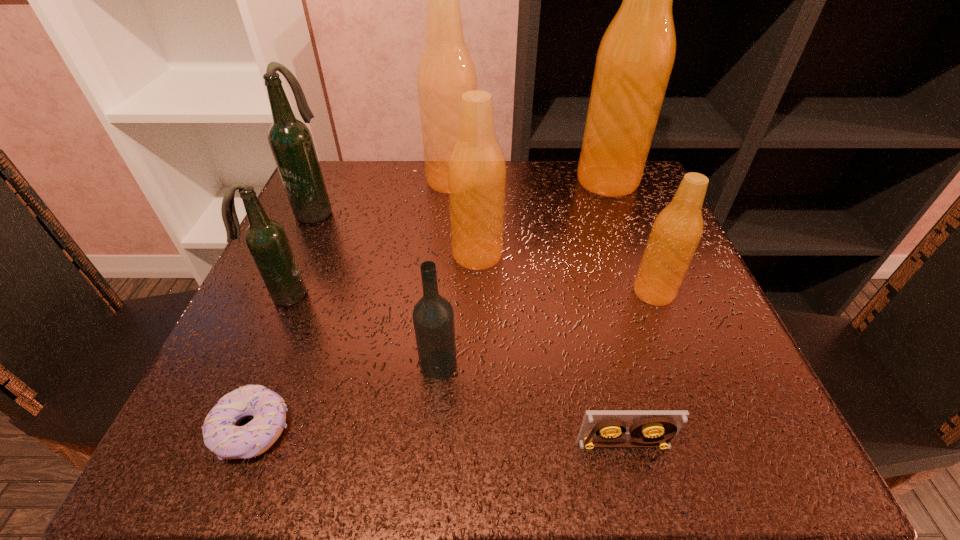
You are a GUI agent. You are given a task and a screenshot of the screen. Output one action in this format:
    pyautogui.click(x=<x>, y=<y>)
    Task: Click on the vacant space that's between the tallest beer bottle and the second smallest tan beer bottle
    The image size is (960, 540).
    Given the screenshot: What is the action you would take?
    pyautogui.click(x=542, y=218)

Where is `vacant area that lies between the tallest beer bottle and the black vodka`? vacant area that lies between the tallest beer bottle and the black vodka is located at coordinates (523, 273).

Where is `free space between the farther dark beer bottle and the third nearest beer bottle`? This screenshot has height=540, width=960. free space between the farther dark beer bottle and the third nearest beer bottle is located at coordinates (396, 233).

This screenshot has width=960, height=540. What are the coordinates of `vacant area that lies between the brown videotape and the third nearest beer bottle` in the screenshot? It's located at (550, 349).

This screenshot has height=540, width=960. I want to click on free space between the nearer dark beer bottle and the second nearest tan beer bottle, so point(381,275).

Where is `empty location between the brown videotape and the fifth shortest beer bottle`? empty location between the brown videotape and the fifth shortest beer bottle is located at coordinates (538, 313).

Where is `free area in between the second tallest beer bottle and the brown videotape`? This screenshot has height=540, width=960. free area in between the second tallest beer bottle and the brown videotape is located at coordinates (538, 313).

Choose which object is the eighth nearest neighbor to the smaller dark beer bottle. Please provide its 2D coordinates. Your answer should be formatted as a tuple, i.e. [(x, y)], where the tuple contains the x and y coordinates of a point satisfying the conditions above.

[(636, 55)]

What are the coordinates of `object that is the fifth closest to the brown videotape` in the screenshot? It's located at (266, 239).

Identify which beer bottle is located as the fifth nearest to the third nearest beer bottle. Please provide its 2D coordinates. Your answer should be formatted as a tuple, i.e. [(x, y)], where the tuple contains the x and y coordinates of a point satisfying the conditions above.

[(290, 140)]